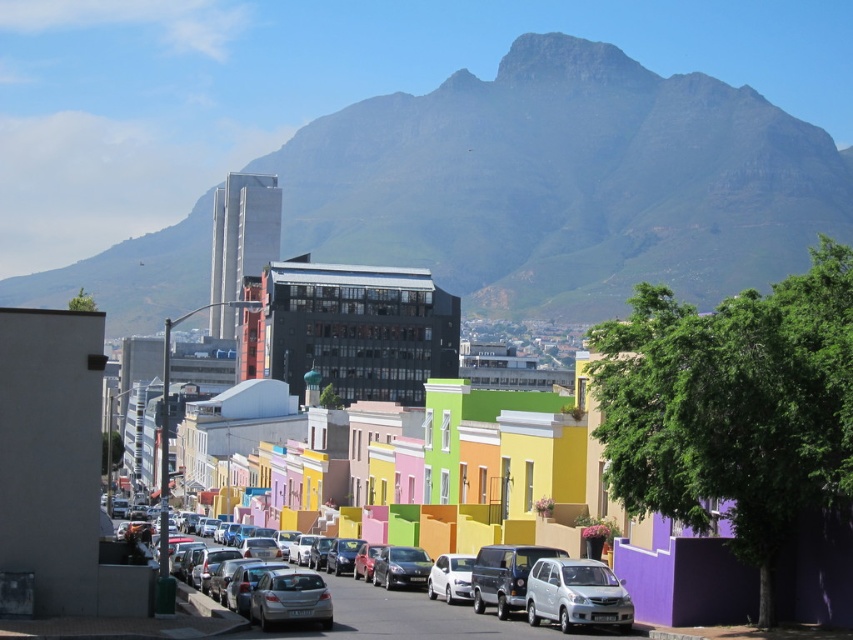
In the scene shown: You are standing in the middle of the street in front of the brightly painted houses. You want to take a photo that includes both the rugged granite mountain at upper center and the parked cars. Since the mountain is far away, will it appear smaller in the photo compared to the parked cars?

The rugged granite mountain at upper center is 1945.26 feet away from viewer. Since it is much farther away than the parked cars which are closer, the mountain will appear smaller in the photo compared to the parked cars.

You are a delivery driver who needs to park your truck, which is 12 feet long, between the shiny silver sedan at center and the white matte van at center. Can you fit your truck in that space?

The distance between the shiny silver sedan at center and the white matte van at center is 10.85 feet, which is shorter than your truck length of 12 feet. Therefore, you cannot fit your truck between them.

You are a delivery driver who needs to park your car between the shiny silver sedan at center and the white glossy car at center. Is there enough space for your car which is 5 meters long?

The shiny silver sedan at center is positioned on the left side of white glossy car at center, but the distance between them is not specified. Without knowing the exact space between the two cars, it is impossible to determine if your 5 meter long car can fit.